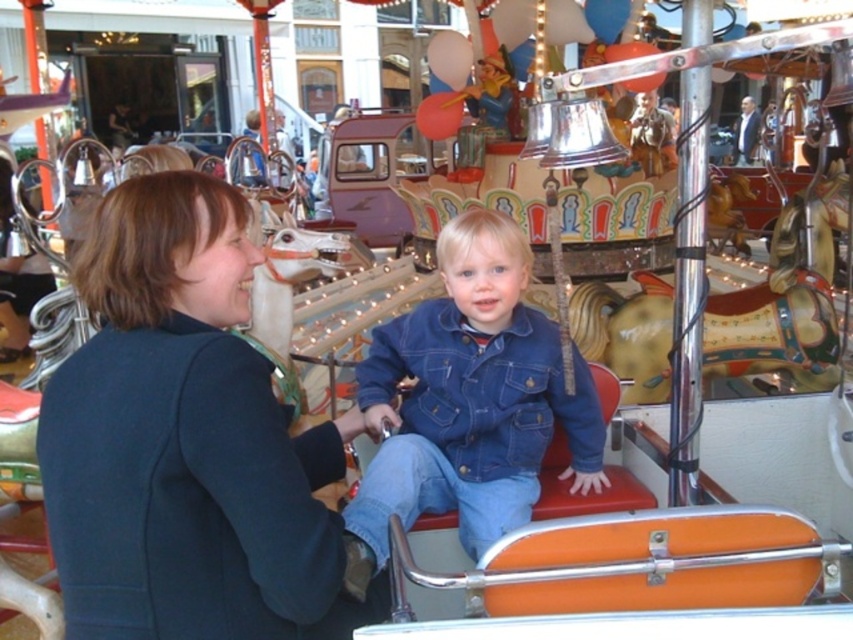
Question: Is dark blue jacket at center to the right of denim jacket at center from the viewer's perspective?

Choices:
 (A) no
 (B) yes

Answer: (A)

Question: Can you confirm if dark blue jacket at center is thinner than denim jacket at center?

Choices:
 (A) no
 (B) yes

Answer: (A)

Question: Which point is farther to the camera?

Choices:
 (A) dark blue jacket at center
 (B) denim jacket at center

Answer: (B)

Question: Is dark blue jacket at center wider than denim jacket at center?

Choices:
 (A) yes
 (B) no

Answer: (A)

Question: Which point is closer to the camera taking this photo?

Choices:
 (A) (254, 502)
 (B) (352, 538)

Answer: (A)

Question: Which point is closer to the camera?

Choices:
 (A) (534, 388)
 (B) (303, 561)

Answer: (B)